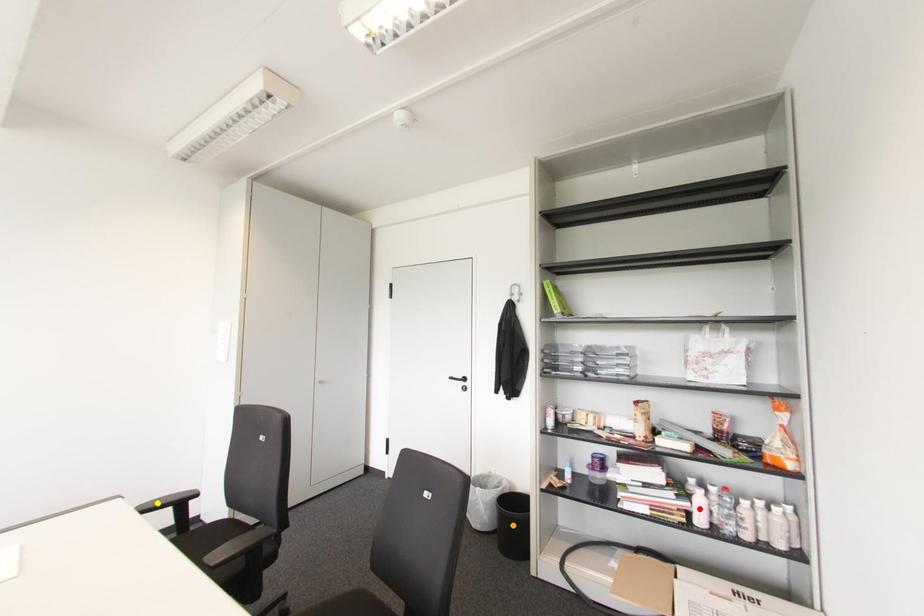
Order these from farthest to nearest:
red point | yellow point | orange point

orange point, red point, yellow point